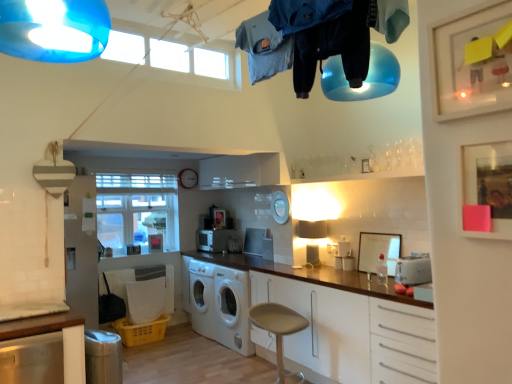
Question: Is clear glass window at center to the right of blue cotton hoodie at upper center, the 1th clothing in the front-to-back sequence, from the viewer's perspective?

Choices:
 (A) yes
 (B) no

Answer: (B)

Question: Is clear glass window at center beside blue cotton hoodie at upper center, acting as the third clothing starting from the back?

Choices:
 (A) no
 (B) yes

Answer: (A)

Question: Is the depth of clear glass window at center greater than that of blue cotton hoodie at upper center, the 1th clothing in the front-to-back sequence?

Choices:
 (A) yes
 (B) no

Answer: (A)

Question: Is clear glass window at center far from blue cotton hoodie at upper center, acting as the third clothing starting from the back?

Choices:
 (A) yes
 (B) no

Answer: (A)

Question: From the image's perspective, is clear glass window at center located above blue cotton hoodie at upper center, the 1th clothing in the front-to-back sequence?

Choices:
 (A) no
 (B) yes

Answer: (A)

Question: Can you confirm if clear glass window at center is bigger than blue cotton hoodie at upper center, acting as the third clothing starting from the back?

Choices:
 (A) no
 (B) yes

Answer: (B)

Question: Does white matte washing machine at center have a smaller size compared to denim shirt at upper center, which ranks as the 1th clothing in back-to-front order?

Choices:
 (A) yes
 (B) no

Answer: (B)

Question: Could you tell me if white matte washing machine at center is facing denim shirt at upper center, positioned as the third clothing in front-to-back order?

Choices:
 (A) yes
 (B) no

Answer: (B)

Question: Is white matte washing machine at center to the left of denim shirt at upper center, which ranks as the 1th clothing in back-to-front order, from the viewer's perspective?

Choices:
 (A) no
 (B) yes

Answer: (B)

Question: From a real-world perspective, is white matte washing machine at center under denim shirt at upper center, which ranks as the 1th clothing in back-to-front order?

Choices:
 (A) no
 (B) yes

Answer: (B)

Question: Considering the relative sizes of white matte washing machine at center and denim shirt at upper center, which ranks as the 1th clothing in back-to-front order, in the image provided, is white matte washing machine at center taller than denim shirt at upper center, which ranks as the 1th clothing in back-to-front order,?

Choices:
 (A) no
 (B) yes

Answer: (B)

Question: Can you confirm if white matte washing machine at center is thinner than denim shirt at upper center, positioned as the third clothing in front-to-back order?

Choices:
 (A) yes
 (B) no

Answer: (B)

Question: Can you confirm if metallic silver toaster at center, which ranks as the 2th appliance in back-to-front order, is positioned to the right of white matte washing machine at center?

Choices:
 (A) yes
 (B) no

Answer: (A)